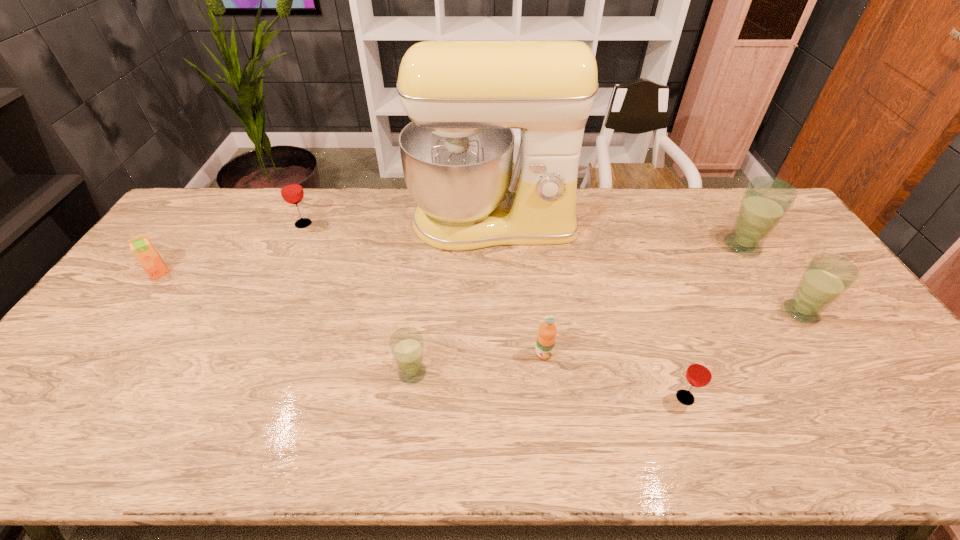
Locate an element on the screen. This screenshot has height=540, width=960. the second nearest glass is located at coordinates (407, 345).

Locate an element on the screen. This screenshot has width=960, height=540. the nearest blue glass is located at coordinates (407, 345).

Locate an element on the screen. The height and width of the screenshot is (540, 960). the smaller red glass is located at coordinates (699, 374).

I want to click on the nearest object, so click(x=699, y=374).

What are the coordinates of `vacant point located on the side of the mixer with the control knob` in the screenshot? It's located at (497, 361).

Where is `vacant space situated on the front of the second farthest glass`? The height and width of the screenshot is (540, 960). vacant space situated on the front of the second farthest glass is located at coordinates coord(765,282).

Image resolution: width=960 pixels, height=540 pixels. In order to click on free region located 0.120m on the back of the farthest glass in this screenshot , I will do `click(315, 198)`.

Identify the location of free space located 0.140m on the front of the second biggest blue glass. The image size is (960, 540). (840, 371).

In order to click on free space located 0.210m on the right of the fourth farthest object in this screenshot , I will do `click(239, 273)`.

Where is `vacant space situated on the label of the right orange juice`? The width and height of the screenshot is (960, 540). vacant space situated on the label of the right orange juice is located at coordinates (550, 400).